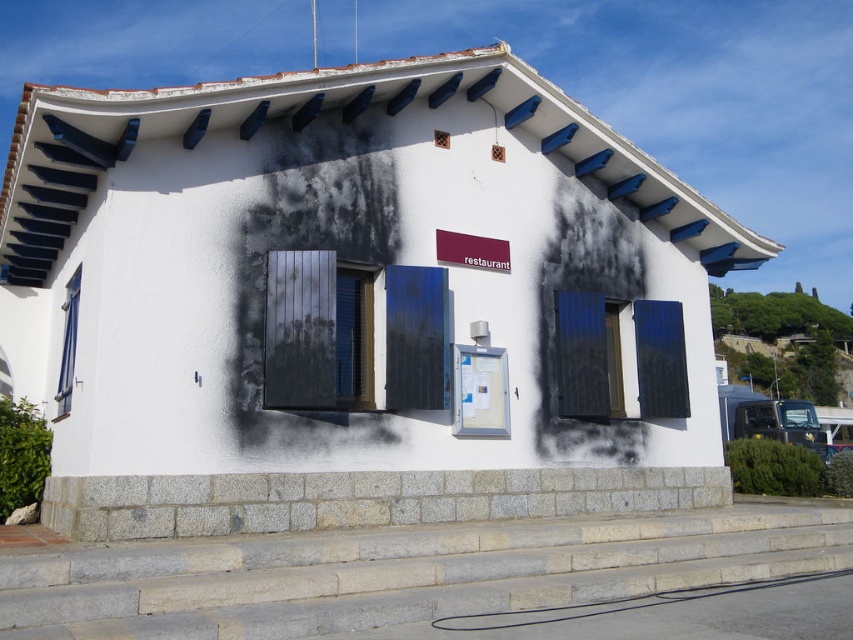
Is matte wood shutter at center above black matte shutter at right?

Yes.

Is matte wood shutter at center taller than black matte shutter at right?

Yes, matte wood shutter at center is taller than black matte shutter at right.

The height and width of the screenshot is (640, 853). Find the location of `matte wood shutter at center`. matte wood shutter at center is located at coordinates (581, 355).

Is point (663, 369) farther from viewer compared to point (65, 339)?

That is True.

Locate an element on the screen. matte black window at center is located at coordinates (582, 355).

What are the coordinates of `matte black window at center` in the screenshot? It's located at (582, 355).

Who is more distant from viewer, (598, 310) or (67, 282)?

Positioned behind is point (598, 310).

Between matte wood shutter at center and matte wood window at left, which one appears on the left side from the viewer's perspective?

matte wood window at left

Measure the distance between matte wood shutter at center and camera.

The distance of matte wood shutter at center from camera is 9.66 meters.

Locate an element on the screen. matte wood shutter at center is located at coordinates (581, 355).